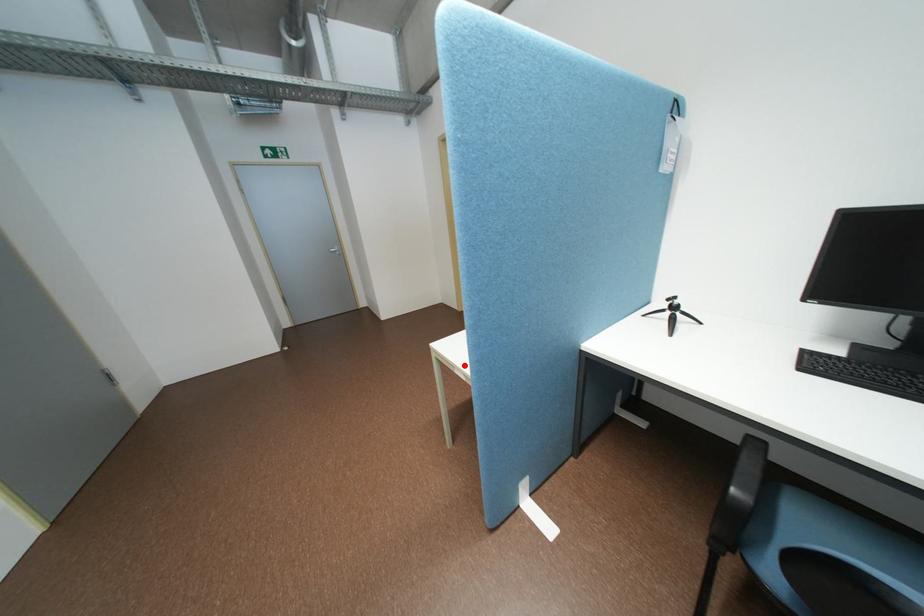
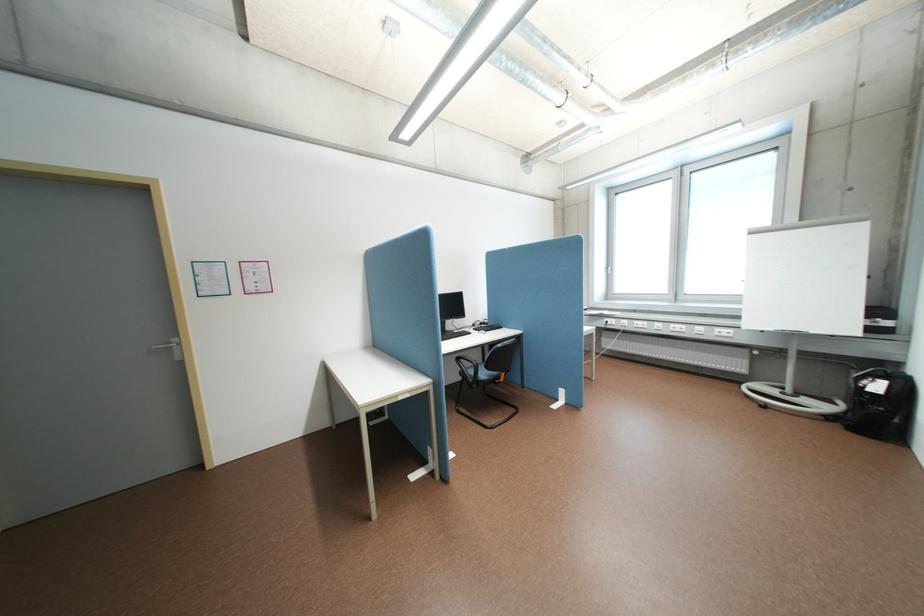
Question: I am providing you with two images of the same scene from different viewpoints. Image1 has a red point marked. In image2, the corresponding 3D location appears at what relative position? Reply with the corresponding letter.

Choices:
 (A) Closer
 (B) Farther

Answer: (A)